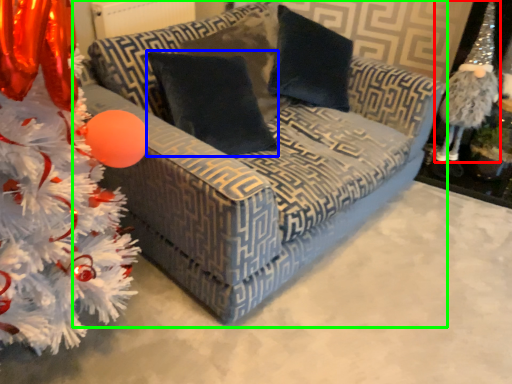
Question: Considering the real-world distances, which object is farthest from toy (highlighted by a red box)? pillow (highlighted by a blue box) or studio couch (highlighted by a green box)?

Choices:
 (A) pillow
 (B) studio couch

Answer: (A)